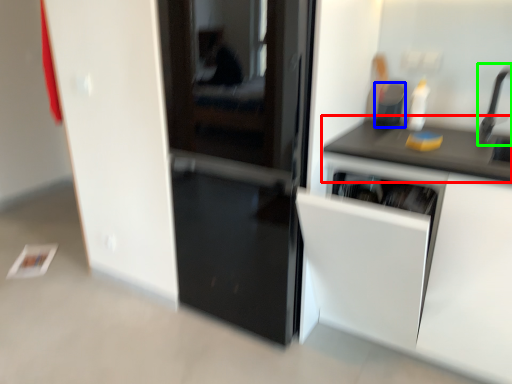
Question: Estimate the real-world distances between objects in this image. Which object is farther from countertop (highlighted by a red box), appliance (highlighted by a blue box) or faucet (highlighted by a green box)?

Choices:
 (A) appliance
 (B) faucet

Answer: (B)